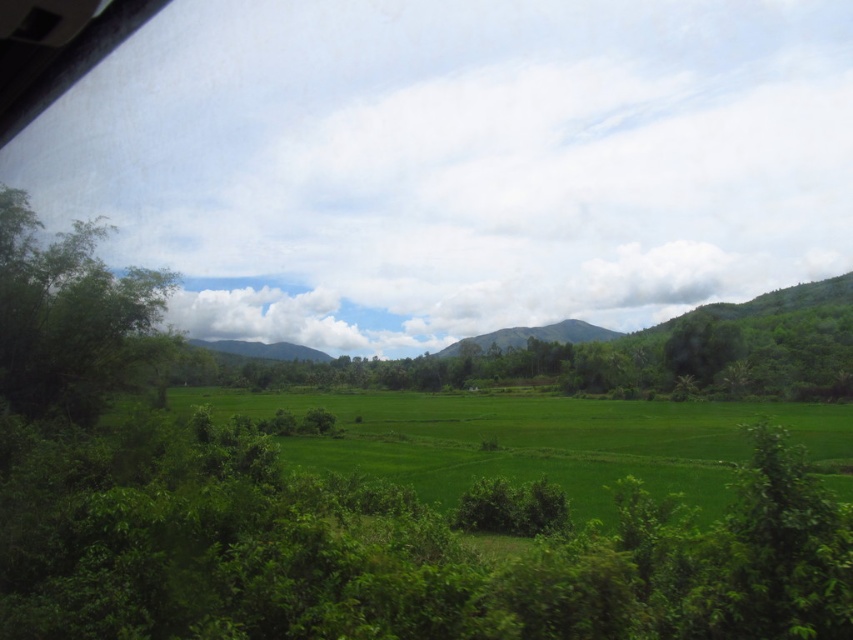
Question: Can you confirm if green grassy field at center is wider than green leafy tree at left?

Choices:
 (A) yes
 (B) no

Answer: (A)

Question: Is the position of green grassy field at center less distant than that of green leafy tree at left?

Choices:
 (A) yes
 (B) no

Answer: (A)

Question: Which point is closer to the camera?

Choices:
 (A) (146, 307)
 (B) (553, 433)

Answer: (A)

Question: Can you confirm if green grassy field at center is wider than green leafy tree at left?

Choices:
 (A) yes
 (B) no

Answer: (A)

Question: Which of the following is the farthest from the observer?

Choices:
 (A) (606, 467)
 (B) (50, 312)

Answer: (A)